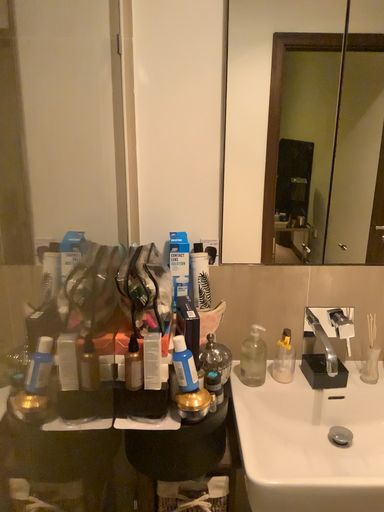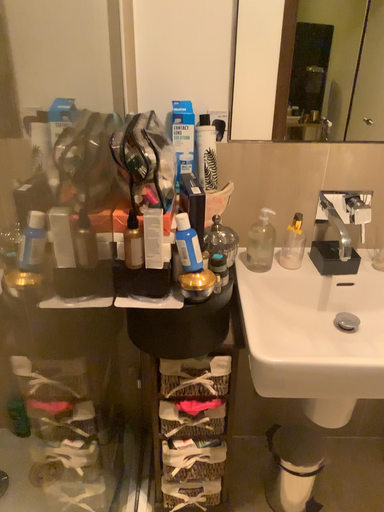
Question: How did the camera likely rotate when shooting the video?

Choices:
 (A) rotated downward
 (B) rotated upward

Answer: (A)